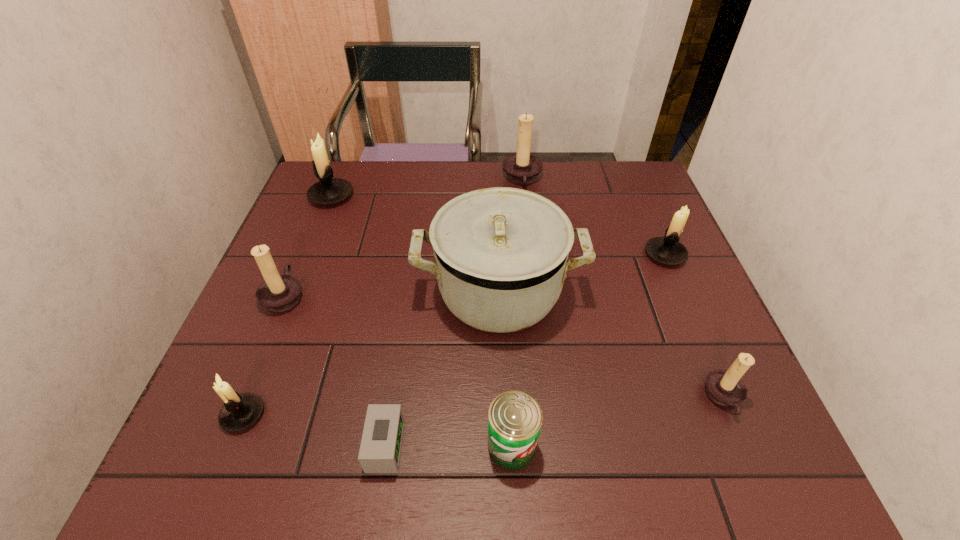
Where is `object that is at the near left corner`? Image resolution: width=960 pixels, height=540 pixels. object that is at the near left corner is located at coordinates (240, 411).

The image size is (960, 540). What are the coordinates of `vacant space at the far edge of the desktop` in the screenshot? It's located at (470, 185).

Identify the location of blank space at the near edge of the desktop. This screenshot has width=960, height=540. (494, 468).

This screenshot has height=540, width=960. What are the coordinates of `free space at the right edge of the desktop` in the screenshot? It's located at (692, 394).

The height and width of the screenshot is (540, 960). In the image, there is a desktop. In order to click on free space at the far right corner in this screenshot , I will do `click(592, 162)`.

The width and height of the screenshot is (960, 540). What are the coordinates of `free space between the smallest brown candle holder and the can` in the screenshot? It's located at (617, 422).

Locate an element on the screen. This screenshot has height=540, width=960. empty space that is in between the smallest white candle holder and the rightmost white candle holder is located at coordinates (454, 334).

Find the location of `blank region between the shortest object and the biggest white candle holder`. blank region between the shortest object and the biggest white candle holder is located at coordinates (358, 321).

Find the location of a particular element. Image resolution: width=960 pixels, height=540 pixels. free space between the can and the white saucepan is located at coordinates (506, 368).

What are the coordinates of `free space between the farthest white candle holder and the can` in the screenshot? It's located at (421, 321).